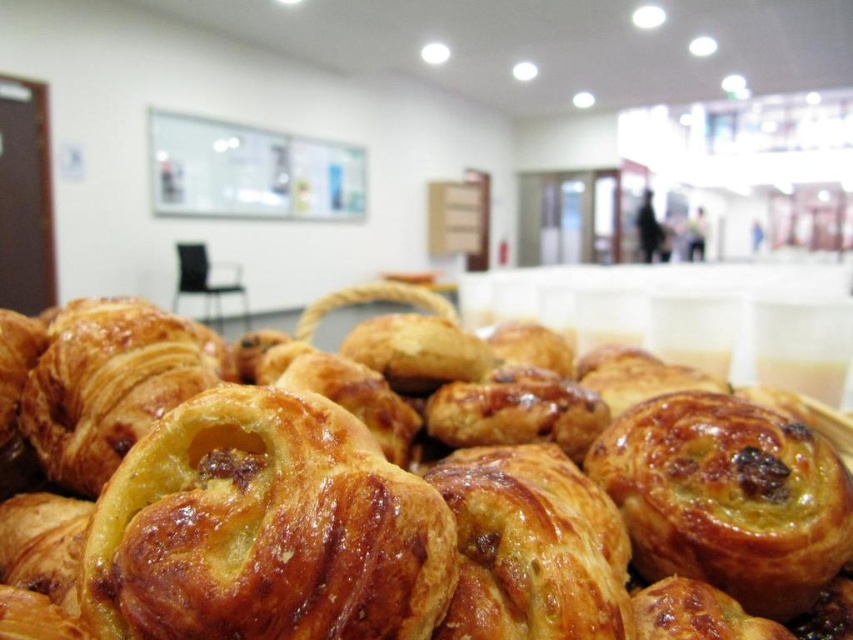
Question: Which point is closer to the camera?

Choices:
 (A) golden-brown flaky pastry at center
 (B) golden brown flaky pastry at center

Answer: (A)

Question: Which object is farther from the camera taking this photo?

Choices:
 (A) golden brown flaky pastry at center
 (B) golden-brown flaky pastry at center

Answer: (A)

Question: Does golden brown flaky pastry at center have a smaller size compared to golden-brown flaky pastry at center?

Choices:
 (A) no
 (B) yes

Answer: (A)

Question: Is golden brown flaky pastry at center positioned before golden-brown flaky pastry at center?

Choices:
 (A) yes
 (B) no

Answer: (B)

Question: Does golden brown flaky pastry at center have a larger size compared to golden-brown flaky pastry at center?

Choices:
 (A) no
 (B) yes

Answer: (B)

Question: Among these objects, which one is farthest from the camera?

Choices:
 (A) golden brown flaky pastry at center
 (B) golden-brown flaky pastry at center

Answer: (A)